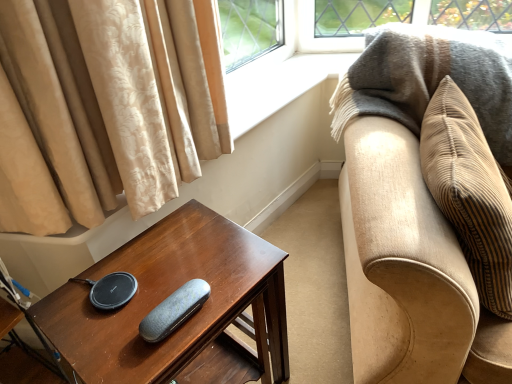
Locate an element on the screen. Image resolution: width=512 pixels, height=384 pixels. free space to the back side of textured gray case at center is located at coordinates (186, 254).